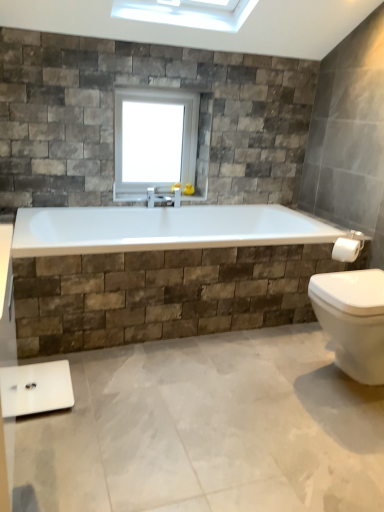
Where is `free spot above white glossy scale at lower left (from a real-world perspective)`? The height and width of the screenshot is (512, 384). free spot above white glossy scale at lower left (from a real-world perspective) is located at coordinates (38, 388).